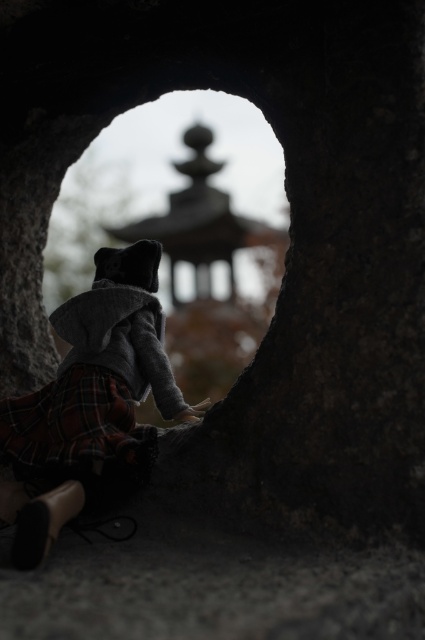
Image resolution: width=425 pixels, height=640 pixels. What do you see at coordinates (91, 396) in the screenshot? I see `plaid fabric skirt at center` at bounding box center [91, 396].

Is plaid fabric skirt at center closer to camera compared to plaid fabric at lower left?

Yes, it is in front of plaid fabric at lower left.

Who is more distant from viewer, (138, 250) or (95, 460)?

Point (138, 250)

I want to click on plaid fabric skirt at center, so click(x=91, y=396).